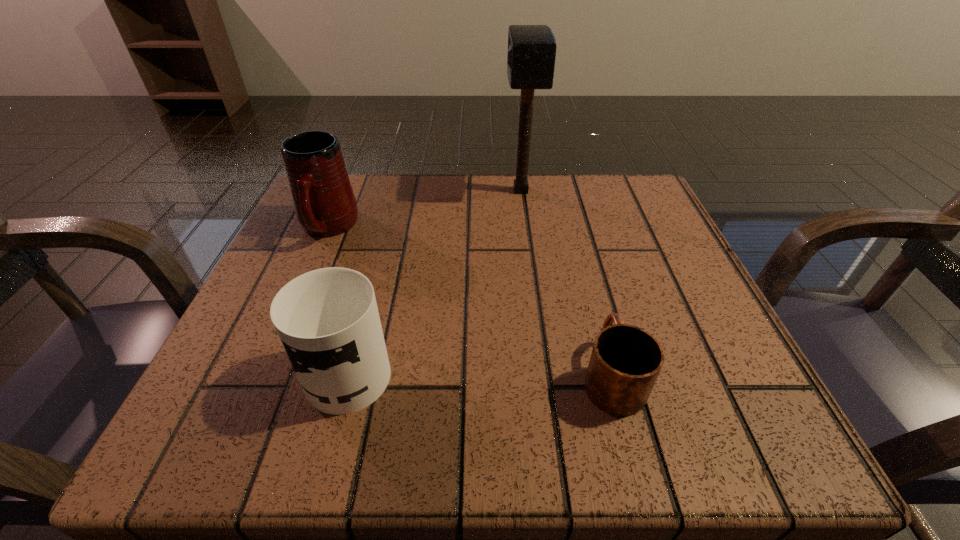
At what (x,y) coordinates should I click in order to perform the action: click on mallet. Please return your answer as a coordinate pair (x, y). This screenshot has width=960, height=540. Looking at the image, I should click on (531, 55).

At what (x,y) coordinates should I click in order to perform the action: click on the third object from left to right. Please return your answer as a coordinate pair (x, y). Looking at the image, I should click on (531, 55).

Where is `the farthest mug`? The width and height of the screenshot is (960, 540). the farthest mug is located at coordinates (325, 205).

The image size is (960, 540). In order to click on the leftmost mug in this screenshot , I will do `click(325, 205)`.

Where is `the second mug from right to left`? Image resolution: width=960 pixels, height=540 pixels. the second mug from right to left is located at coordinates (327, 319).

Find the location of a particular element. The height and width of the screenshot is (540, 960). the rightmost mug is located at coordinates (625, 362).

Where is `the rightmost object`? Image resolution: width=960 pixels, height=540 pixels. the rightmost object is located at coordinates (625, 362).

Find the location of a particular element. Image resolution: width=960 pixels, height=540 pixels. vacant space located 0.180m on the right of the mallet is located at coordinates (619, 191).

Where is `free space located on the side of the farthest mug with the handle`? The image size is (960, 540). free space located on the side of the farthest mug with the handle is located at coordinates (292, 310).

This screenshot has width=960, height=540. Identify the location of free location located on the handle side of the second object from left to right. (383, 245).